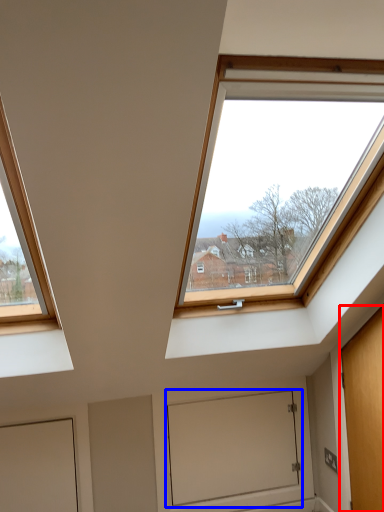
Question: Which object appears closest to the camera in this image, door (highlighted by a red box) or window screen (highlighted by a blue box)?

Choices:
 (A) door
 (B) window screen

Answer: (A)